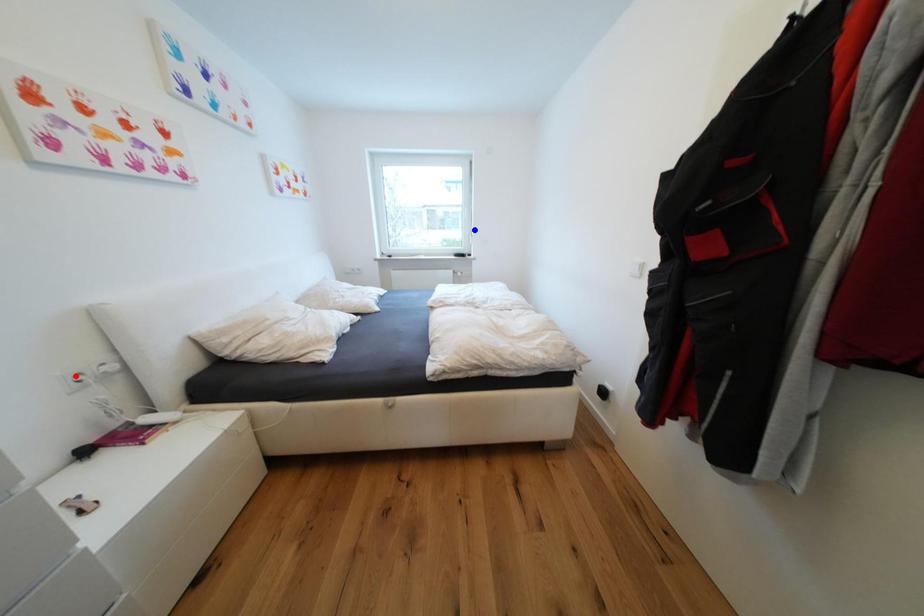
Question: In the image, two points are highlighted. Which point is nearer to the camera? Reply with the corresponding letter.

Choices:
 (A) blue point
 (B) red point

Answer: (B)